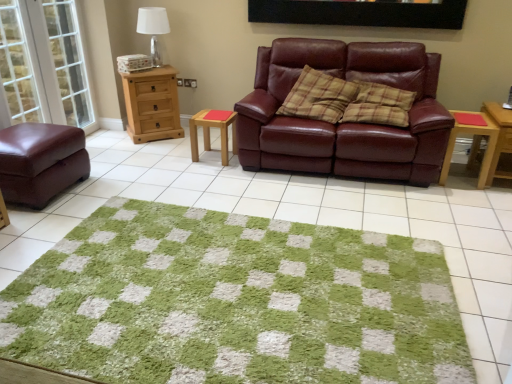
Question: Could you tell me if natural wood chest of drawers at left is turned towards white fabric lampshade at upper left?

Choices:
 (A) no
 (B) yes

Answer: (A)

Question: From the image's perspective, would you say natural wood chest of drawers at left is shown under white fabric lampshade at upper left?

Choices:
 (A) no
 (B) yes

Answer: (B)

Question: Is natural wood chest of drawers at left touching white fabric lampshade at upper left?

Choices:
 (A) yes
 (B) no

Answer: (B)

Question: Can you confirm if natural wood chest of drawers at left is positioned to the left of white fabric lampshade at upper left?

Choices:
 (A) no
 (B) yes

Answer: (B)

Question: Is natural wood chest of drawers at left far away from white fabric lampshade at upper left?

Choices:
 (A) no
 (B) yes

Answer: (A)

Question: From a real-world perspective, is clear glass door at left, the 2th glass door in the right-to-left sequence, physically located above or below plaid fabric pillow at center, positioned as the second pillow in left-to-right order?

Choices:
 (A) above
 (B) below

Answer: (A)

Question: In terms of width, does clear glass door at left, which appears as the first glass door when viewed from the left, look wider or thinner when compared to plaid fabric pillow at center, positioned as the second pillow in left-to-right order?

Choices:
 (A) wide
 (B) thin

Answer: (B)

Question: Is clear glass door at left, the 2th glass door in the right-to-left sequence, spatially inside plaid fabric pillow at center, the first pillow positioned from the right, or outside of it?

Choices:
 (A) outside
 (B) inside

Answer: (A)

Question: In terms of size, does clear glass door at left, which appears as the first glass door when viewed from the left, appear bigger or smaller than plaid fabric pillow at center, the first pillow positioned from the right?

Choices:
 (A) big
 (B) small

Answer: (B)

Question: Is point (204, 132) closer or farther from the camera than point (485, 119)?

Choices:
 (A) farther
 (B) closer

Answer: (A)

Question: From the image's perspective, is wooden stool at center, placed as the first table when sorted from left to right, positioned above or below wooden side table at right, the second table from the left?

Choices:
 (A) below
 (B) above

Answer: (B)

Question: Would you say wooden stool at center, placed as the first table when sorted from left to right, is to the left or to the right of wooden side table at right, the second table from the left, in the picture?

Choices:
 (A) left
 (B) right

Answer: (A)

Question: In terms of size, does wooden stool at center, which is the 3th table in right-to-left order, appear bigger or smaller than wooden side table at right, the second table from the left?

Choices:
 (A) big
 (B) small

Answer: (B)

Question: Is point (54, 1) closer or farther from the camera than point (369, 87)?

Choices:
 (A) closer
 (B) farther

Answer: (B)

Question: Is transparent glass door at left, the 1th glass door in the right-to-left sequence, spatially inside plaid fabric pillow at center, the first pillow positioned from the right, or outside of it?

Choices:
 (A) outside
 (B) inside

Answer: (A)